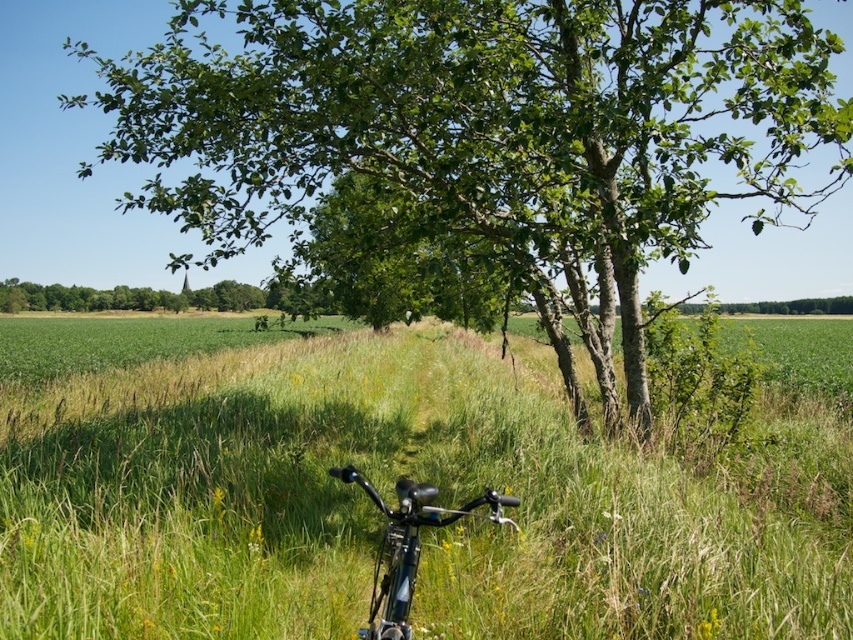
You are standing at the edge of the field looking towards the tree. You see the green grassy at lower center and the shiny metallic bicycle at lower center. Which object is located to the right of the bicycle?

The green grassy at lower center is positioned on the right side of the shiny metallic bicycle at lower center.

You are standing in the rural landscape and want to walk from point [706,125] to point [361,483]. Which direction should you move relative to your current position?

You should move away from yourself because point [706,125] is closer to you than point [361,483].